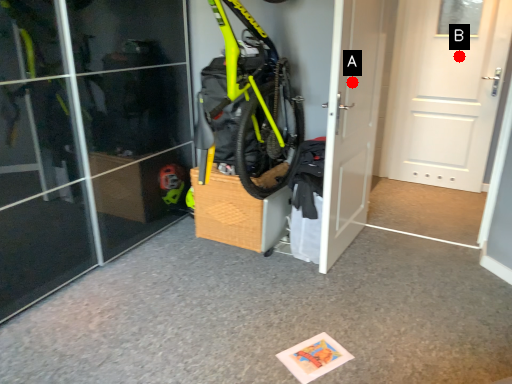
Question: Two points are circled on the image, labeled by A and B beside each circle. Which of the following is the closest to the observer?

Choices:
 (A) A is closer
 (B) B is closer

Answer: (A)